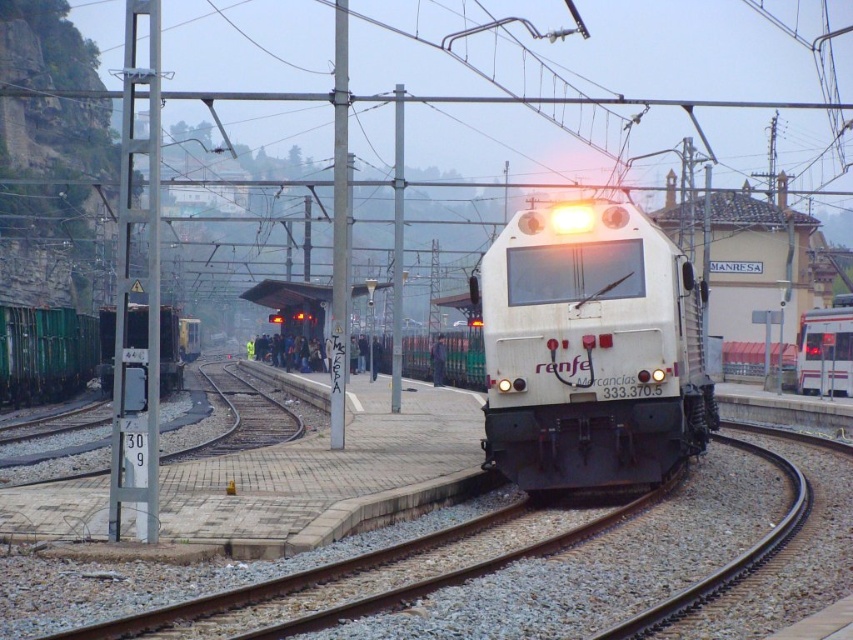
Is green matte freight car at left shorter than white glossy train at center?

Indeed, green matte freight car at left has a lesser height compared to white glossy train at center.

Is green matte freight car at left further to camera compared to white glossy train at center?

No, green matte freight car at left is closer to the viewer.

Locate an element on the screen. Image resolution: width=853 pixels, height=640 pixels. green matte freight car at left is located at coordinates (51, 353).

Can you confirm if white matte locomotive at center is positioned above white glossy train at center?

Yes, white matte locomotive at center is above white glossy train at center.

Locate an element on the screen. The width and height of the screenshot is (853, 640). white matte locomotive at center is located at coordinates (590, 348).

Locate an element on the screen. white matte locomotive at center is located at coordinates (590, 348).

Does white matte locomotive at center come in front of green matte freight car at left?

No, it is not.

The width and height of the screenshot is (853, 640). Find the location of `white matte locomotive at center`. white matte locomotive at center is located at coordinates (590, 348).

The image size is (853, 640). What do you see at coordinates (590, 348) in the screenshot? I see `white matte locomotive at center` at bounding box center [590, 348].

This screenshot has width=853, height=640. I want to click on white matte locomotive at center, so click(x=590, y=348).